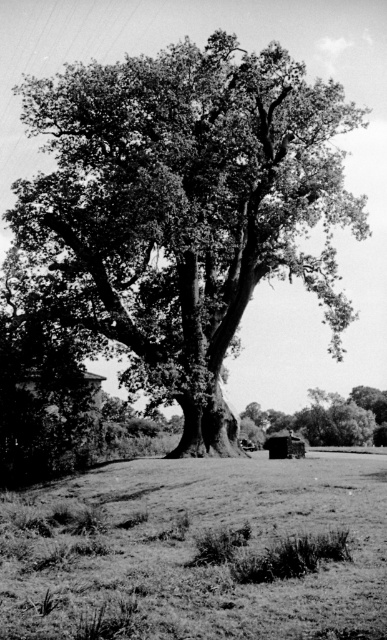
Who is positioned more to the right, dark green leafy oak tree at center or grassy field at center?

From the viewer's perspective, grassy field at center appears more on the right side.

Which is in front, point (203, 145) or point (10, 520)?

Point (10, 520) is more forward.

Where is `dark green leafy oak tree at center`? Image resolution: width=387 pixels, height=640 pixels. dark green leafy oak tree at center is located at coordinates (184, 208).

Where is `dark green leafy oak tree at center`? dark green leafy oak tree at center is located at coordinates (184, 208).

Does point (244, 156) come in front of point (381, 394)?

Yes, it is.

Between dark green leafy oak tree at center and thick textured trunk at center, which one appears on the right side from the viewer's perspective?

thick textured trunk at center

Who is more forward, (174,225) or (363,422)?

Point (174,225) is in front.

I want to click on dark green leafy oak tree at center, so click(x=184, y=208).

I want to click on grassy field at center, so click(198, 550).

Does grassy field at center have a greater width compared to thick textured trunk at center?

Yes, grassy field at center is wider than thick textured trunk at center.

Is point (325, 627) behind point (351, 428)?

No.

The height and width of the screenshot is (640, 387). I want to click on grassy field at center, so click(198, 550).